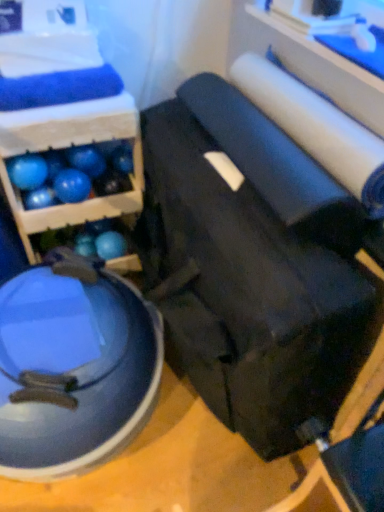
Question: From the image's perspective, would you say blue rubber ball at lower left, placed as the 4th ball when sorted from right to left, is shown under glossy blue exercise ball at lower left, the second swivel chair in the right-to-left sequence?

Choices:
 (A) yes
 (B) no

Answer: (B)

Question: From a real-world perspective, is blue rubber ball at lower left, placed as the 4th ball when sorted from right to left, over glossy blue exercise ball at lower left, the second swivel chair in the right-to-left sequence?

Choices:
 (A) yes
 (B) no

Answer: (A)

Question: Considering the relative positions of blue rubber ball at lower left, the 2th ball when ordered from left to right, and glossy blue exercise ball at lower left, which appears as the 1th swivel chair when viewed from the left, in the image provided, is blue rubber ball at lower left, the 2th ball when ordered from left to right, in front of glossy blue exercise ball at lower left, which appears as the 1th swivel chair when viewed from the left,?

Choices:
 (A) no
 (B) yes

Answer: (A)

Question: Is blue rubber ball at lower left, the 2th ball when ordered from left to right, aimed at glossy blue exercise ball at lower left, which appears as the 1th swivel chair when viewed from the left?

Choices:
 (A) yes
 (B) no

Answer: (B)

Question: Can you confirm if blue rubber ball at lower left, placed as the 4th ball when sorted from right to left, is positioned to the left of glossy blue exercise ball at lower left, which appears as the 1th swivel chair when viewed from the left?

Choices:
 (A) yes
 (B) no

Answer: (A)

Question: Looking at the image, does blue rubber ball at upper left, arranged as the 5th ball when viewed from the right, seem bigger or smaller compared to blue rubber ball at center-left, placed as the second ball when sorted from right to left?

Choices:
 (A) big
 (B) small

Answer: (A)

Question: Is blue rubber ball at upper left, the first ball when ordered from left to right, situated inside blue rubber ball at center-left, the fourth ball from the left, or outside?

Choices:
 (A) inside
 (B) outside

Answer: (B)

Question: In the image, is blue rubber ball at upper left, the first ball when ordered from left to right, positioned in front of or behind blue rubber ball at center-left, placed as the second ball when sorted from right to left?

Choices:
 (A) behind
 (B) front

Answer: (B)

Question: From a real-world perspective, is blue rubber ball at upper left, the first ball when ordered from left to right, positioned above or below blue rubber ball at center-left, the fourth ball from the left?

Choices:
 (A) below
 (B) above

Answer: (A)

Question: From the image's perspective, is black leather swivel chair at center, acting as the 2th swivel chair starting from the left, above or below white matte toilet paper at upper right?

Choices:
 (A) above
 (B) below

Answer: (B)

Question: Considering the positions of point (223, 184) and point (362, 194), is point (223, 184) closer or farther from the camera than point (362, 194)?

Choices:
 (A) farther
 (B) closer

Answer: (A)

Question: Based on their sizes in the image, would you say black leather swivel chair at center, acting as the 2th swivel chair starting from the left, is bigger or smaller than white matte toilet paper at upper right?

Choices:
 (A) small
 (B) big

Answer: (B)

Question: Is black leather swivel chair at center, acting as the 2th swivel chair starting from the left, in front of or behind white matte toilet paper at upper right in the image?

Choices:
 (A) behind
 (B) front

Answer: (B)

Question: From their relative heights in the image, would you say blue rubber ball at upper left, the first ball when ordered from left to right, is taller or shorter than blue rubber ball at lower left, the 2th ball when ordered from left to right?

Choices:
 (A) short
 (B) tall

Answer: (B)

Question: From the image's perspective, is blue rubber ball at upper left, arranged as the 5th ball when viewed from the right, above or below blue rubber ball at lower left, the 2th ball when ordered from left to right?

Choices:
 (A) below
 (B) above

Answer: (B)